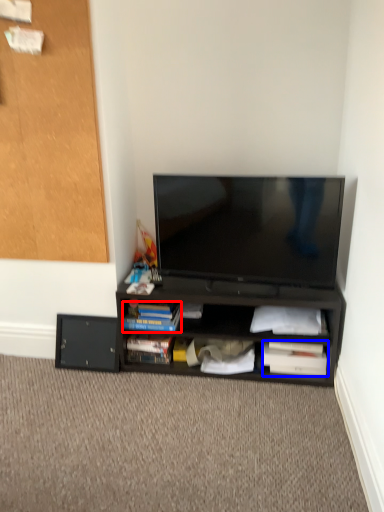
Question: Which point is closer to the camera, paperback book (highlighted by a red box) or paperback book (highlighted by a blue box)?

Choices:
 (A) paperback book
 (B) paperback book

Answer: (A)